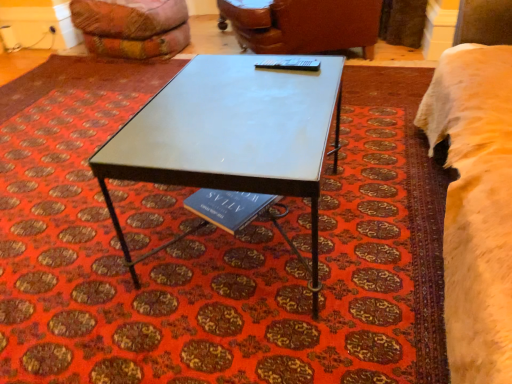
Question: Is fuzzy cream bed at right at the left side of velvet orange bean bag at upper left?

Choices:
 (A) no
 (B) yes

Answer: (A)

Question: Is fuzzy cream bed at right facing towards velvet orange bean bag at upper left?

Choices:
 (A) no
 (B) yes

Answer: (B)

Question: Is fuzzy cream bed at right looking in the opposite direction of velvet orange bean bag at upper left?

Choices:
 (A) yes
 (B) no

Answer: (B)

Question: Considering the relative positions of fuzzy cream bed at right and velvet orange bean bag at upper left in the image provided, is fuzzy cream bed at right to the right of velvet orange bean bag at upper left from the viewer's perspective?

Choices:
 (A) yes
 (B) no

Answer: (A)

Question: From the image's perspective, is fuzzy cream bed at right located beneath velvet orange bean bag at upper left?

Choices:
 (A) yes
 (B) no

Answer: (A)

Question: From the image's perspective, is velvet orange bean bag at upper left positioned above or below leather couch at upper center?

Choices:
 (A) below
 (B) above

Answer: (B)

Question: Is point (114, 34) closer or farther from the camera than point (373, 33)?

Choices:
 (A) closer
 (B) farther

Answer: (B)

Question: Is velvet orange bean bag at upper left situated inside leather couch at upper center or outside?

Choices:
 (A) outside
 (B) inside

Answer: (A)

Question: Considering the positions of velvet orange bean bag at upper left and leather couch at upper center in the image, is velvet orange bean bag at upper left taller or shorter than leather couch at upper center?

Choices:
 (A) tall
 (B) short

Answer: (B)

Question: Is fuzzy cream bed at right spatially inside leather couch at upper center, or outside of it?

Choices:
 (A) outside
 (B) inside

Answer: (A)

Question: Considering the positions of fuzzy cream bed at right and leather couch at upper center in the image, is fuzzy cream bed at right wider or thinner than leather couch at upper center?

Choices:
 (A) thin
 (B) wide

Answer: (A)

Question: From the image's perspective, is fuzzy cream bed at right positioned above or below leather couch at upper center?

Choices:
 (A) above
 (B) below

Answer: (B)

Question: Is fuzzy cream bed at right in front of or behind leather couch at upper center in the image?

Choices:
 (A) behind
 (B) front

Answer: (B)

Question: Relative to metallic blue table tennis table at center, is velvet orange bean bag at upper left in front or behind?

Choices:
 (A) behind
 (B) front

Answer: (A)

Question: Which is correct: velvet orange bean bag at upper left is inside metallic blue table tennis table at center, or outside of it?

Choices:
 (A) outside
 (B) inside

Answer: (A)